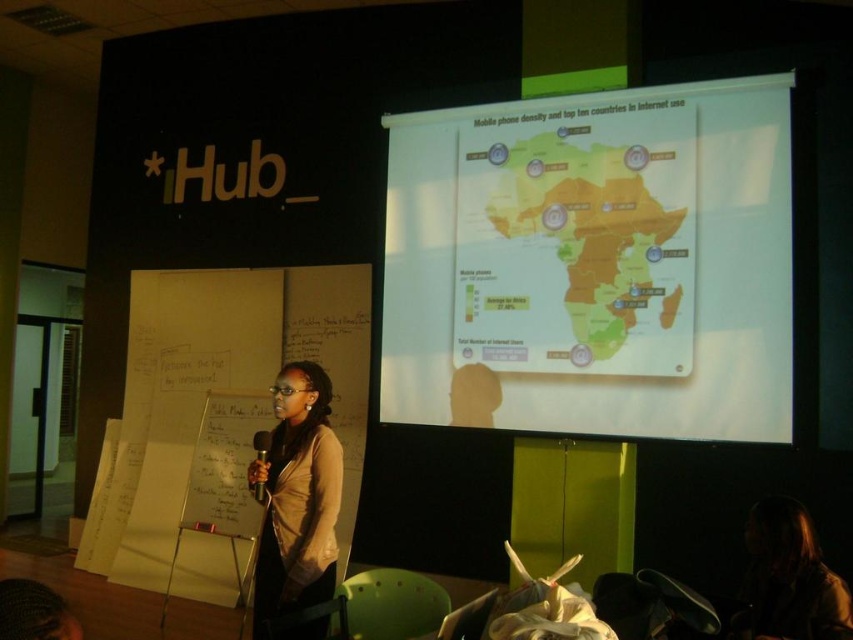
You are attending a presentation and notice the presenter wearing a matte beige sweater at center and holding a metallic silver microphone at center. Which object is taller when viewed from the audience perspective?

The matte beige sweater at center is taller than the metallic silver microphone at center.

Based on the photo, in the conference room scene, where exactly is the matte plastic map at center located in terms of coordinates?

The matte plastic map at center is located at coordinates point (595, 262).

You are an attendee in the conference room who wants to move from your seat to the front. You need to pass between the matte plastic map at center and the metallic silver microphone at center. If your backpack is 0.5 meters wide, will there be enough space to walk through without touching either object?

The distance between the matte plastic map at center and the metallic silver microphone at center is 1.94 meters. Subtracting the backpack width of 0.5 meters, there would still be 1.44 meters of space remaining. This is more than sufficient to pass through without touching either object.